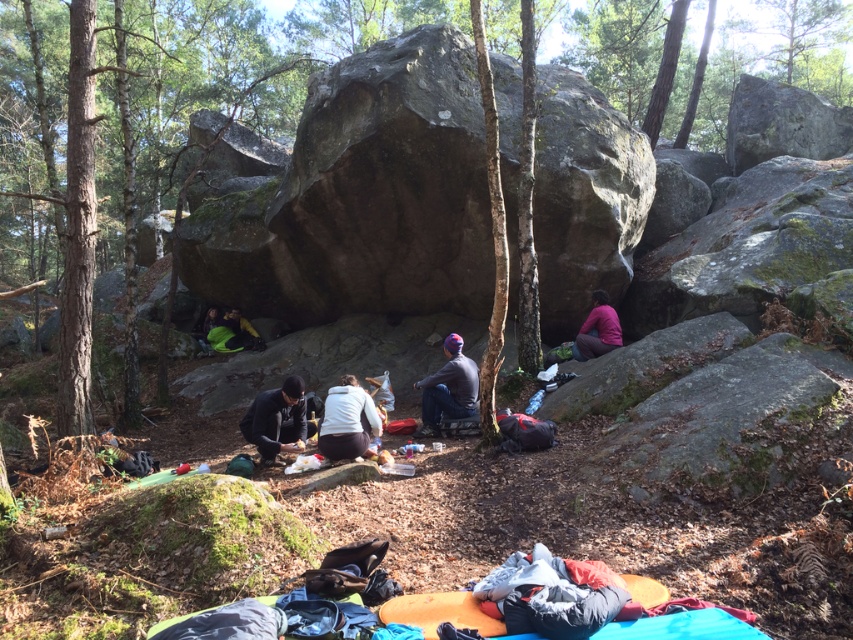
Between white fleece jacket at center and pink fabric at center-right, which one has more height?

Standing taller between the two is pink fabric at center-right.

Can you confirm if white fleece jacket at center is positioned above pink fabric at center-right?

No, white fleece jacket at center is not above pink fabric at center-right.

Describe the element at coordinates (347, 420) in the screenshot. I see `white fleece jacket at center` at that location.

Where is `white fleece jacket at center`? This screenshot has height=640, width=853. white fleece jacket at center is located at coordinates (347, 420).

Is white fleece jacket at center above green fabric bag at lower left?

Actually, white fleece jacket at center is below green fabric bag at lower left.

Between white fleece jacket at center and green fabric bag at lower left, which one appears on the right side from the viewer's perspective?

white fleece jacket at center is more to the right.

Between point (332, 442) and point (239, 314), which one is positioned behind?

The point (239, 314) is behind.

Locate an element on the screen. The width and height of the screenshot is (853, 640). white fleece jacket at center is located at coordinates (347, 420).

Between black matte jacket at center and green fabric bag at lower left, which one appears on the right side from the viewer's perspective?

black matte jacket at center

Can you confirm if black matte jacket at center is bigger than green fabric bag at lower left?

Incorrect, black matte jacket at center is not larger than green fabric bag at lower left.

What do you see at coordinates (277, 419) in the screenshot? This screenshot has width=853, height=640. I see `black matte jacket at center` at bounding box center [277, 419].

Locate an element on the screen. black matte jacket at center is located at coordinates (277, 419).